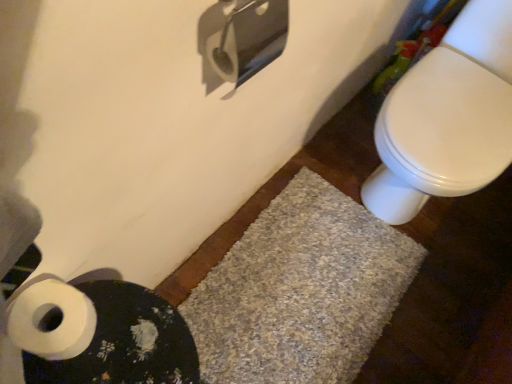
Question: In the image, is gray shaggy bath mat at lower center, which appears as the second bath mat when viewed from the front, positioned in front of or behind white matte toilet paper at lower left?

Choices:
 (A) behind
 (B) front

Answer: (A)

Question: From a real-world perspective, is gray shaggy bath mat at lower center, which is the 1th bath mat in back-to-front order, above or below white matte toilet paper at lower left?

Choices:
 (A) above
 (B) below

Answer: (B)

Question: Estimate the real-world distances between objects in this image. Which object is farther from the white glossy toilet at right?

Choices:
 (A) gray shaggy bath mat at lower center, which appears as the second bath mat when viewed from the front
 (B) white textured bath mat at lower left, the 1th bath mat viewed from the front
 (C) white matte toilet paper at lower left

Answer: (C)

Question: Which object is positioned farthest from the gray shaggy bath mat at lower center, which is the 1th bath mat in back-to-front order?

Choices:
 (A) white textured bath mat at lower left, the 1th bath mat viewed from the front
 (B) white glossy toilet at right
 (C) white matte toilet paper at lower left

Answer: (C)